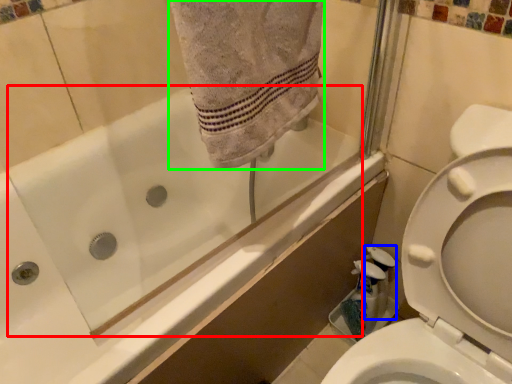
Question: Which is farther away from bath (highlighted by a red box)? cleaning product (highlighted by a blue box) or bath towel (highlighted by a green box)?

Choices:
 (A) cleaning product
 (B) bath towel

Answer: (A)